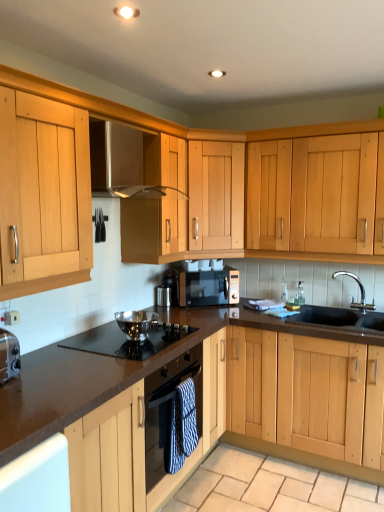
This screenshot has height=512, width=384. Identify the location of empty space that is ontop of beige stone granite at lower center (from a real-world perspective). (268, 484).